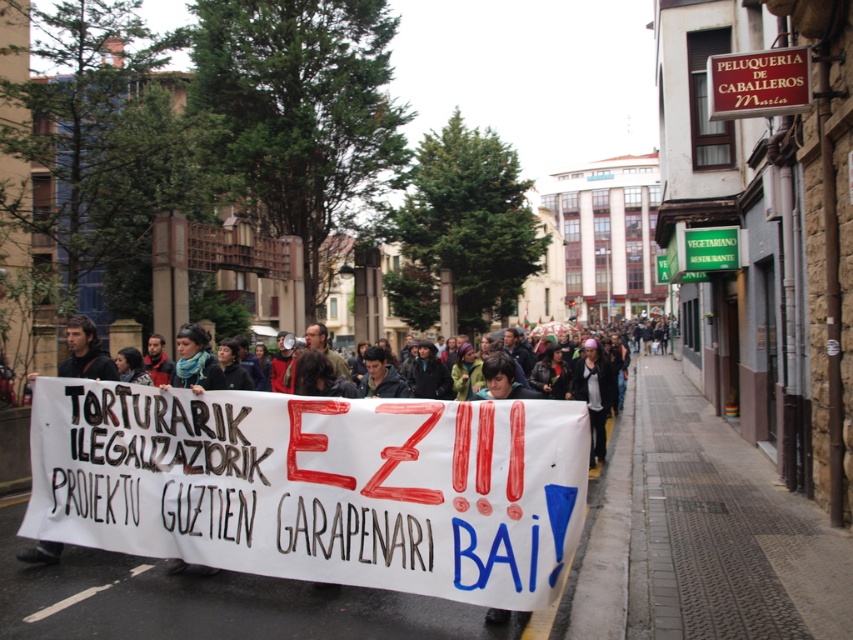
Question: Which object is positioned farthest from the white paper banner at center?

Choices:
 (A) red wood sign at upper right
 (B) blue scarf at center
 (C) dark brown leather jacket at center

Answer: (A)

Question: Is matte black jacket at center positioned in front of blue scarf at center?

Choices:
 (A) yes
 (B) no

Answer: (B)

Question: Which object is closer to the camera taking this photo?

Choices:
 (A) red wood sign at upper right
 (B) blue scarf at center

Answer: (B)

Question: Considering the relative positions of red wood sign at upper right and matte black jacket at center in the image provided, where is red wood sign at upper right located with respect to matte black jacket at center?

Choices:
 (A) above
 (B) below

Answer: (A)

Question: From the image, what is the correct spatial relationship of white paper banner at center in relation to blue scarf at center?

Choices:
 (A) right
 (B) left

Answer: (A)

Question: Which object is farther from the camera taking this photo?

Choices:
 (A) dark brown leather jacket at center
 (B) white paper banner at center
 (C) matte black jacket at center

Answer: (C)